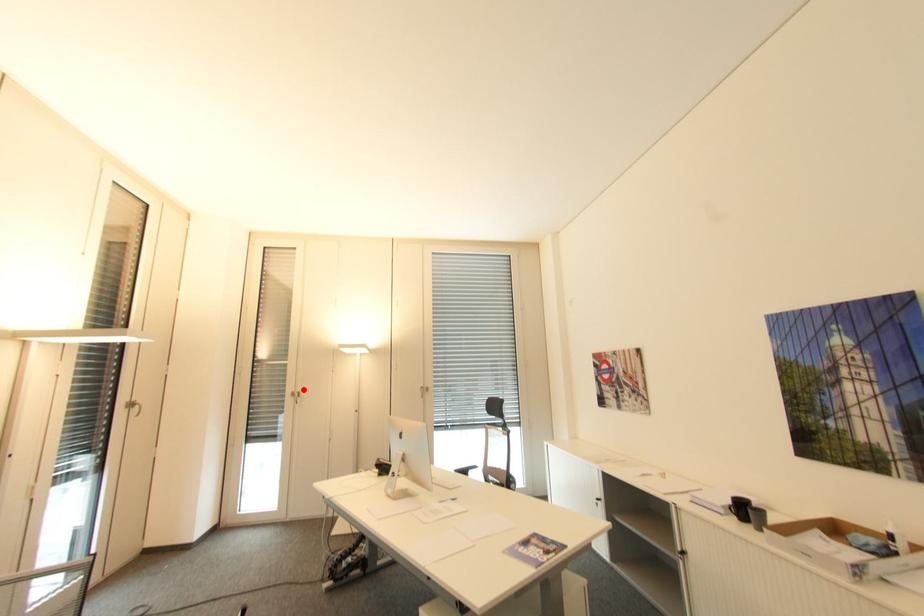
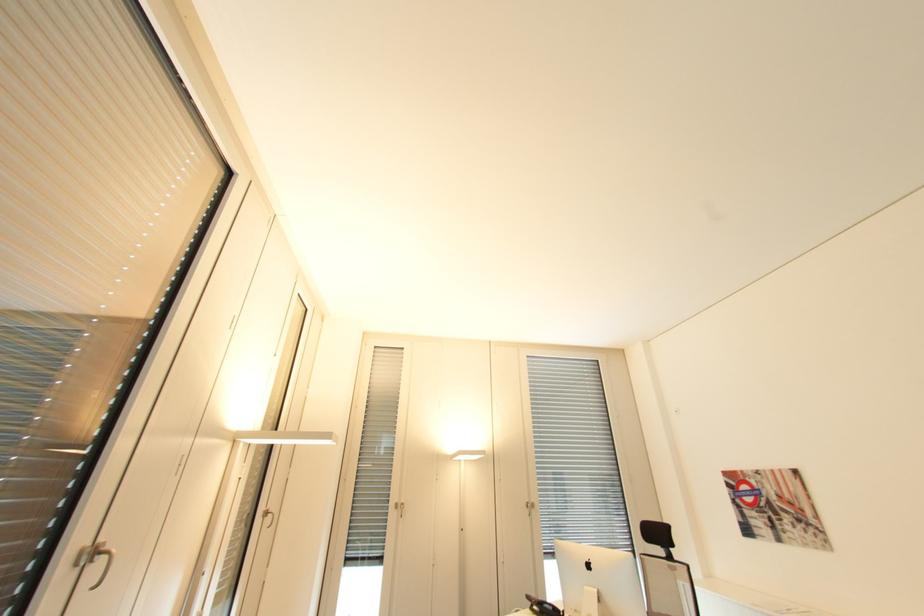
Find the pixel in the second image that matches the highlighted location in the first image.

(407, 501)